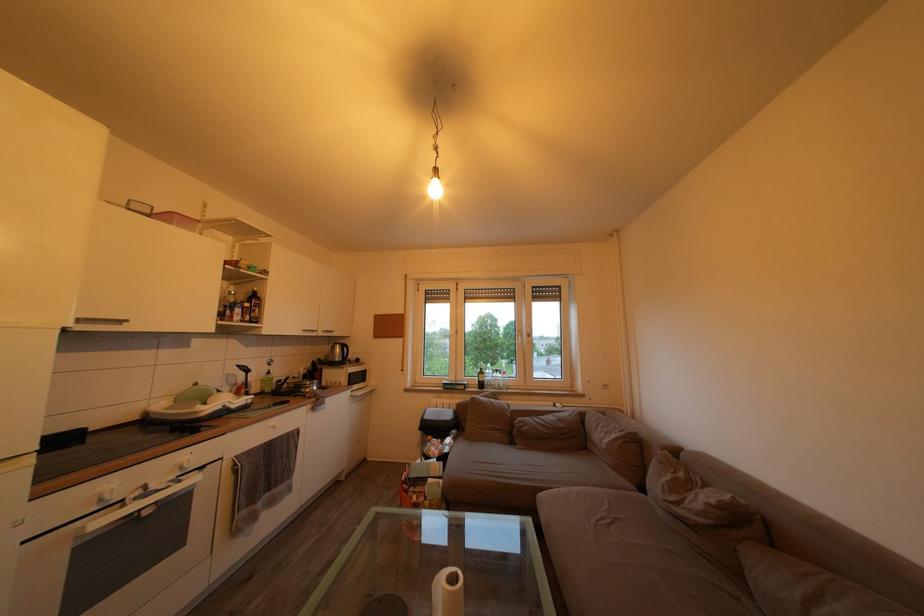
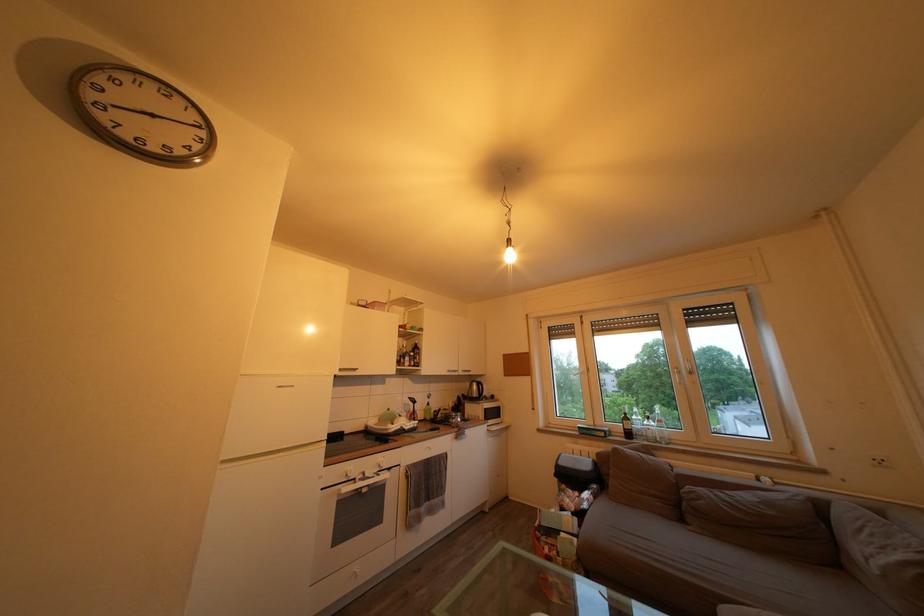
Where in the second image is the point corresponding to [356,400] from the first image?

(492, 434)